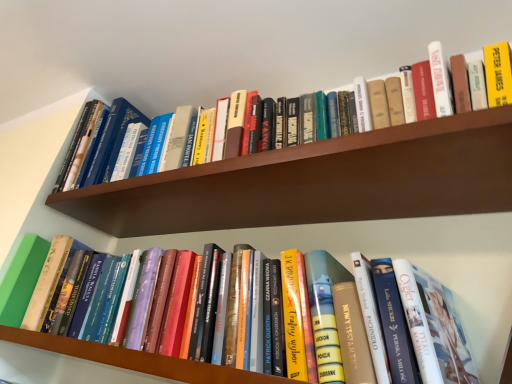
Question: Is hardcover books at center, the 2th shelf from the top, oriented away from wooden bookshelf at upper center, positioned as the 1th shelf in top-to-bottom order?

Choices:
 (A) yes
 (B) no

Answer: (B)

Question: Is hardcover books at center, placed as the first shelf when sorted from bottom to top, positioned behind wooden bookshelf at upper center, the 2th shelf in the bottom-to-top sequence?

Choices:
 (A) no
 (B) yes

Answer: (A)

Question: Does hardcover books at center, placed as the first shelf when sorted from bottom to top, have a greater width compared to wooden bookshelf at upper center, the 2th shelf in the bottom-to-top sequence?

Choices:
 (A) yes
 (B) no

Answer: (B)

Question: Are hardcover books at center, the 2th shelf from the top, and wooden bookshelf at upper center, the 2th shelf in the bottom-to-top sequence, located far from each other?

Choices:
 (A) no
 (B) yes

Answer: (A)

Question: From the image's perspective, is hardcover books at center, the 2th shelf from the top, located beneath wooden bookshelf at upper center, the 2th shelf in the bottom-to-top sequence?

Choices:
 (A) yes
 (B) no

Answer: (A)

Question: From the image's perspective, is hardcover books at center, the 2th shelf from the top, above wooden bookshelf at upper center, positioned as the 1th shelf in top-to-bottom order?

Choices:
 (A) no
 (B) yes

Answer: (A)

Question: Is hardcover book at center, the first book ordered from the bottom, shorter than wooden bookshelf at upper center, the 2th shelf in the bottom-to-top sequence?

Choices:
 (A) yes
 (B) no

Answer: (B)

Question: Can you confirm if hardcover book at center, the 2th book when ordered from top to bottom, is wider than wooden bookshelf at upper center, the 2th shelf in the bottom-to-top sequence?

Choices:
 (A) no
 (B) yes

Answer: (A)

Question: Would you say hardcover book at center, the first book ordered from the bottom, contains wooden bookshelf at upper center, the 2th shelf in the bottom-to-top sequence?

Choices:
 (A) no
 (B) yes

Answer: (A)

Question: From a real-world perspective, is hardcover book at center, the 2th book when ordered from top to bottom, positioned under wooden bookshelf at upper center, the 2th shelf in the bottom-to-top sequence, based on gravity?

Choices:
 (A) no
 (B) yes

Answer: (B)

Question: Is hardcover book at center, the 2th book when ordered from top to bottom, further to camera compared to wooden bookshelf at upper center, positioned as the 1th shelf in top-to-bottom order?

Choices:
 (A) yes
 (B) no

Answer: (B)

Question: Can we say hardcover book at center, the first book ordered from the bottom, lies outside wooden bookshelf at upper center, the 2th shelf in the bottom-to-top sequence?

Choices:
 (A) yes
 (B) no

Answer: (A)

Question: Is hardcover book at upper center, the second book in the bottom-to-top sequence, far from hardcover book at center, the 2th book when ordered from top to bottom?

Choices:
 (A) yes
 (B) no

Answer: (B)